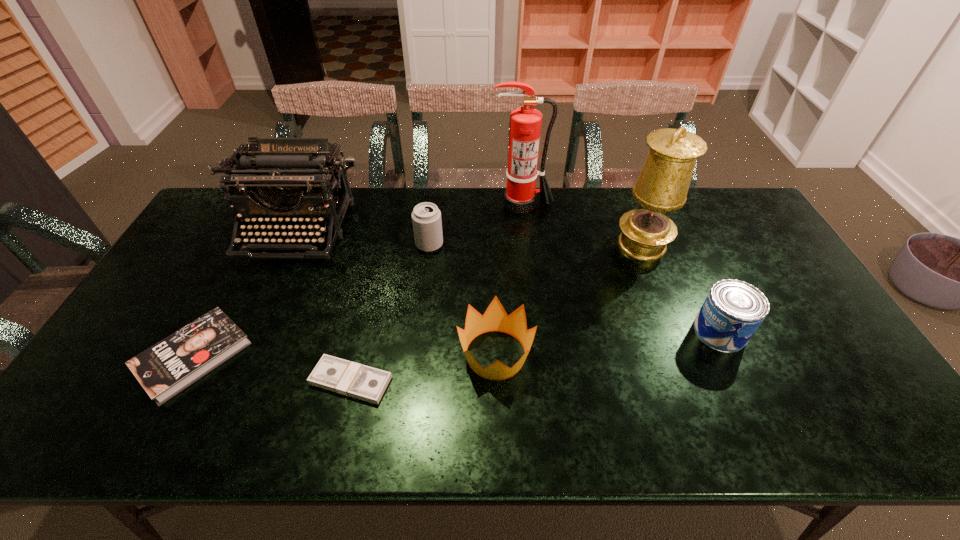
You are a GUI agent. You are given a task and a screenshot of the screen. Output one action in this format:
    pyautogui.click(x=<x>, y=<y>)
    Task: Click on the oil lamp positioned at the far edge
    This screenshot has height=540, width=960.
    Given the screenshot: What is the action you would take?
    pyautogui.click(x=662, y=186)

At what (x,y) coordinates should I click in order to perform the action: click on typewriter at the far edge. Please return your answer as a coordinate pair (x, y). The width and height of the screenshot is (960, 540). Looking at the image, I should click on (286, 190).

At what (x,y) coordinates should I click in order to perform the action: click on typewriter at the left edge. Please return your answer as a coordinate pair (x, y). The width and height of the screenshot is (960, 540). Looking at the image, I should click on (286, 190).

Where is `book at the left edge`? book at the left edge is located at coordinates (165, 369).

I want to click on object that is positioned at the far left corner, so click(286, 190).

Locate an element on the screen. The width and height of the screenshot is (960, 540). vacant space at the far edge of the desktop is located at coordinates [x=380, y=198].

Locate an element on the screen. The height and width of the screenshot is (540, 960). vacant space at the near edge of the desktop is located at coordinates (495, 443).

At what (x,y) coordinates should I click in order to perform the action: click on vacant space at the left edge of the desktop. Please return your answer as a coordinate pair (x, y). Looking at the image, I should click on (198, 309).

This screenshot has height=540, width=960. I want to click on free region at the right edge of the desktop, so click(784, 278).

I want to click on blank area at the far left corner, so [x=220, y=215].